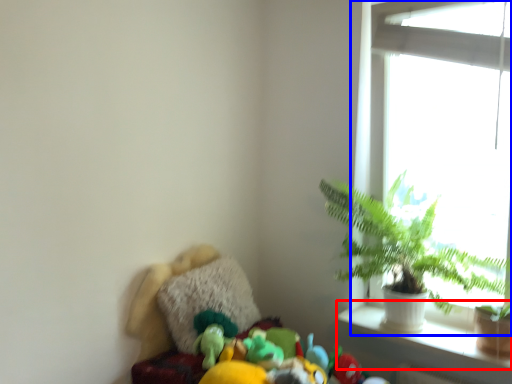
Question: Which object is closer to the camera taking this photo, window sill (highlighted by a red box) or window (highlighted by a blue box)?

Choices:
 (A) window sill
 (B) window

Answer: (B)